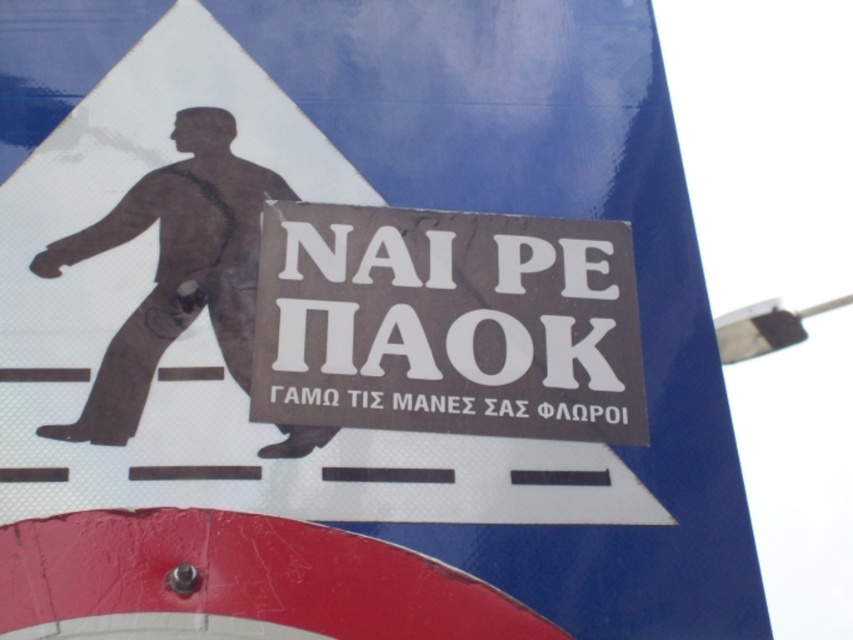
You are a pedestrian trying to read the messages on the white paper sign at center and the brown matte figure at center. Which object has a larger size?

The brown matte figure at center is larger than the white paper sign at center.